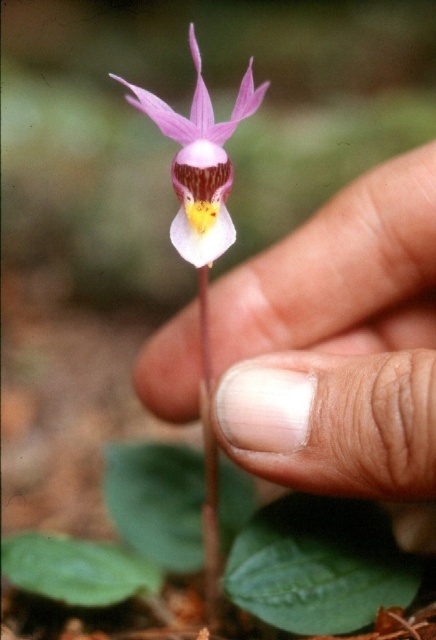
Does point (271, 300) come in front of point (204, 152)?

No.

Is smooth skin hand at center taller than purple matte orchid at center?

Yes, smooth skin hand at center is taller than purple matte orchid at center.

Describe the element at coordinates (340, 349) in the screenshot. The width and height of the screenshot is (436, 640). I see `smooth skin hand at center` at that location.

This screenshot has width=436, height=640. Find the location of `smooth skin hand at center`. smooth skin hand at center is located at coordinates (340, 349).

Image resolution: width=436 pixels, height=640 pixels. What do you see at coordinates (200, 161) in the screenshot?
I see `purple matte orchid at center` at bounding box center [200, 161].

In the scene shown: Is purple matte orchid at center thinner than green matte stem at center?

Incorrect, purple matte orchid at center's width is not less than green matte stem at center's.

Find the location of `purple matte orchid at center`. purple matte orchid at center is located at coordinates (200, 161).

Image resolution: width=436 pixels, height=640 pixels. In order to click on purple matte orchid at center in this screenshot , I will do `click(200, 161)`.

Looking at this image, can you confirm if smooth skin hand at center is positioned below green matte stem at center?

Actually, smooth skin hand at center is above green matte stem at center.

Is point (388, 401) positioned in front of point (211, 440)?

That is True.

At what (x,y) coordinates should I click in order to perform the action: click on smooth skin hand at center. Please return your answer as a coordinate pair (x, y). Looking at the image, I should click on (340, 349).